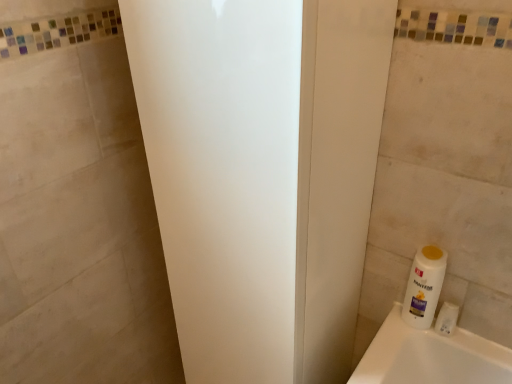
You are a GUI agent. You are given a task and a screenshot of the screen. Output one action in this format:
    pyautogui.click(x=<x>, y=<y>)
    Task: Click on the white matte screen door at center
    The image size is (512, 384).
    Given the screenshot: What is the action you would take?
    pyautogui.click(x=223, y=174)

In order to face white plastic bottle at lower right, should I rotate leftwards or rightwards?

You should look right and rotate roughly 21.447 degrees.

This screenshot has height=384, width=512. Find the location of `white plastic bottle at lower right`. white plastic bottle at lower right is located at coordinates (447, 319).

Where is `white matte screen door at center`? This screenshot has width=512, height=384. white matte screen door at center is located at coordinates pos(223,174).

Is white matte screen door at center inside or outside of white plastic bottle at lower right?

white matte screen door at center is not inside white plastic bottle at lower right, it's outside.

Is white matte screen door at center bigger or smaller than white plastic bottle at lower right?

white matte screen door at center is bigger than white plastic bottle at lower right.

From a real-world perspective, which is physically below, white matte screen door at center or white plastic bottle at lower right?

white matte screen door at center is physically lower.

Does white matte screen door at center have a lesser width compared to white plastic bottle at lower right?

Incorrect, the width of white matte screen door at center is not less than that of white plastic bottle at lower right.

From the image's perspective, is white plastic bottle at lower right located above white matte screen door at center?

No, from the image's perspective, white plastic bottle at lower right is not on top of white matte screen door at center.

Is white matte screen door at center inside white plastic bottle at lower right?

No, white matte screen door at center is not inside white plastic bottle at lower right.

Locate an element on the screen. The height and width of the screenshot is (384, 512). screen door that is on the left side of white plastic bottle at lower right is located at coordinates (223, 174).

Can you confirm if white plastic bottle at lower right is taller than white matte screen door at center?

No.

Does white plastic bottle at lower right have a greater width compared to white plastic bottle at lower right?

In fact, white plastic bottle at lower right might be narrower than white plastic bottle at lower right.

Which point is more distant from viewer, (445, 302) or (408, 290)?

Point (408, 290)

Is white plastic bottle at lower right next to white plastic bottle at lower right?

Indeed, white plastic bottle at lower right and white plastic bottle at lower right are beside each other and touching.

Are white matte screen door at center and white plastic bottle at lower right beside each other?

Answer: There is a gap between white matte screen door at center and white plastic bottle at lower right.

Identify the location of screen door above the white plastic bottle at lower right (from the image's perspective). coord(223,174).

From a real-world perspective, is white matte screen door at center positioned over white plastic bottle at lower right based on gravity?

Yes, from a real-world perspective, white matte screen door at center is above white plastic bottle at lower right.

Is white matte screen door at center surrounding white plastic bottle at lower right?

No, white matte screen door at center does not contain white plastic bottle at lower right.

From a real-world perspective, is white plastic bottle at lower right located higher than white plastic bottle at lower right?

Yes, from a real-world perspective, white plastic bottle at lower right is over white plastic bottle at lower right

From the picture: Is white plastic bottle at lower right placed right next to white plastic bottle at lower right?

Yes, white plastic bottle at lower right is beside white plastic bottle at lower right.

Is white plastic bottle at lower right in front of or behind white plastic bottle at lower right in the image?

white plastic bottle at lower right is positioned closer to the viewer than white plastic bottle at lower right.

At what (x,y) coordinates should I click in order to perform the action: click on cleaning product that is above the white plastic bottle at lower right (from the image's perspective). Please return your answer as a coordinate pair (x, y). Looking at the image, I should click on (424, 286).

From a real-world perspective, is white plastic bottle at lower right below white matte screen door at center?

No.

Is white plastic bottle at lower right oriented away from white matte screen door at center?

white plastic bottle at lower right does not have its back to white matte screen door at center.

Is white plastic bottle at lower right not close to white matte screen door at center?

That's not correct — white plastic bottle at lower right is a little close to white matte screen door at center.

You are a GUI agent. You are given a task and a screenshot of the screen. Output one action in this format:
    pyautogui.click(x=<x>, y=<y>)
    Task: Click on the cleaning product below the white matte screen door at center (from the image's perspective)
    
    Given the screenshot: What is the action you would take?
    pyautogui.click(x=424, y=286)

Locate an element on the screen. The image size is (512, 384). toiletry that is on the right side of white matte screen door at center is located at coordinates (447, 319).

Estimate the real-world distances between objects in this image. Which object is further from white plastic bottle at lower right, white matte screen door at center or white plastic bottle at lower right?

white matte screen door at center.

Looking at this image, when comparing their distances from white matte screen door at center, does white plastic bottle at lower right or white plastic bottle at lower right seem closer?

white plastic bottle at lower right is positioned closer to the anchor white matte screen door at center.

Which object lies nearer to the anchor point white plastic bottle at lower right, white plastic bottle at lower right or white matte screen door at center?

Among the two, white plastic bottle at lower right is located nearer to white plastic bottle at lower right.

In the scene shown: From the image, which object appears to be farther from white matte screen door at center, white plastic bottle at lower right or white plastic bottle at lower right?

The object further to white matte screen door at center is white plastic bottle at lower right.

Looking at the image, which one is located further to white plastic bottle at lower right, white matte screen door at center or white plastic bottle at lower right?

white matte screen door at center is positioned further to the anchor white plastic bottle at lower right.

From the image, which object appears to be farther from white plastic bottle at lower right, white plastic bottle at lower right or white matte screen door at center?

white matte screen door at center is further to white plastic bottle at lower right.

This screenshot has height=384, width=512. What are the coordinates of `cleaning product between white matte screen door at center and white plastic bottle at lower right from front to back` in the screenshot? It's located at (424, 286).